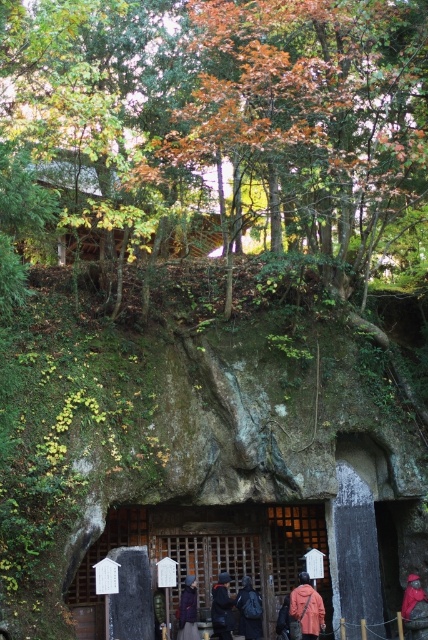
Who is more forward, (308, 586) or (252, 620)?

Positioned in front is point (308, 586).

Which is behind, point (318, 611) or point (246, 580)?

Positioned behind is point (246, 580).

The height and width of the screenshot is (640, 428). What are the coordinates of `pink fabric coat at center` in the screenshot? It's located at (306, 608).

Is red fabric jacket at center taller than dark blue fabric at center?

Indeed, red fabric jacket at center has a greater height compared to dark blue fabric at center.

Who is lower down, red fabric jacket at center or dark blue fabric at center?

red fabric jacket at center is below.

Describe the element at coordinates (415, 609) in the screenshot. The width and height of the screenshot is (428, 640). I see `red fabric jacket at center` at that location.

Identify the location of red fabric jacket at center. The image size is (428, 640). (415, 609).

Which is above, pink fabric coat at center or red fabric jacket at center?

pink fabric coat at center

Is point (318, 608) closer to viewer compared to point (404, 620)?

Yes, it is.

Where is `pink fabric coat at center`? Image resolution: width=428 pixels, height=640 pixels. pink fabric coat at center is located at coordinates (306, 608).

At what (x,y) coordinates should I click in order to perform the action: click on pink fabric coat at center. Please return your answer as a coordinate pair (x, y). This screenshot has height=640, width=428. Looking at the image, I should click on 306,608.